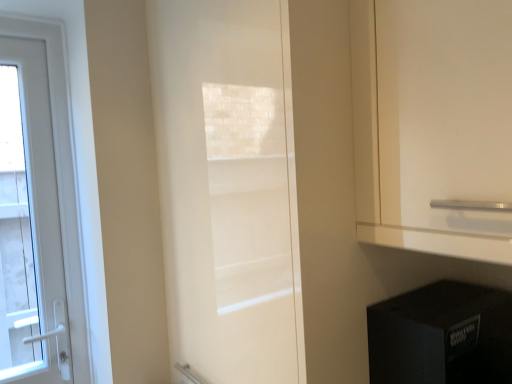
In order to face white glossy door at left, marked as the second door in a front-to-back arrangement, should I rotate leftwards or rightwards?

To face it directly, rotate left by 29.955 degrees.

Locate an element on the screen. white glossy door at left, arranged as the second door when viewed from the right is located at coordinates [x=30, y=224].

Considering the relative positions of black plastic speaker at lower right and white glossy door at left, arranged as the second door when viewed from the right, in the image provided, is black plastic speaker at lower right to the left of white glossy door at left, arranged as the second door when viewed from the right, from the viewer's perspective?

No, black plastic speaker at lower right is not to the left of white glossy door at left, arranged as the second door when viewed from the right.

From a real-world perspective, is black plastic speaker at lower right physically located above or below white glossy door at left, acting as the first door starting from the left?

black plastic speaker at lower right is situated lower than white glossy door at left, acting as the first door starting from the left, in the real world.

How different are the orientations of black plastic speaker at lower right and white glossy door at left, marked as the second door in a front-to-back arrangement, in degrees?

88.2 degrees.

Is black plastic speaker at lower right in front of or behind white glossy door at left, acting as the first door starting from the left, in the image?

Visually, black plastic speaker at lower right is located in front of white glossy door at left, acting as the first door starting from the left.

Which is in front, white glossy door at left, placed as the 1th door when sorted from back to front, or black plastic speaker at lower right?

black plastic speaker at lower right is in front.

The height and width of the screenshot is (384, 512). In order to click on appliance in front of the white glossy door at left, acting as the first door starting from the left in this screenshot , I will do click(x=442, y=336).

From the picture: In terms of size, does white glossy door at left, arranged as the second door when viewed from the right, appear bigger or smaller than black plastic speaker at lower right?

Clearly, white glossy door at left, arranged as the second door when viewed from the right, is smaller in size than black plastic speaker at lower right.

Looking at this image, is white glossy door at center, the 2th door when ordered from back to front, positioned before white glossy door at left, marked as the second door in a front-to-back arrangement?

That is True.

Where is `door located on the right of white glossy door at left, arranged as the second door when viewed from the right`? Image resolution: width=512 pixels, height=384 pixels. door located on the right of white glossy door at left, arranged as the second door when viewed from the right is located at coordinates (227, 189).

Between white glossy door at center, positioned as the 2th door in left-to-right order, and white glossy door at left, acting as the first door starting from the left, which one has larger size?

With larger size is white glossy door at center, positioned as the 2th door in left-to-right order.

Which of these two, white glossy door at center, which is the 1th door in front-to-back order, or white glossy door at left, placed as the 1th door when sorted from back to front, is thinner?

white glossy door at left, placed as the 1th door when sorted from back to front, is thinner.

Is white glossy door at center, which is the 1th door in front-to-back order, to the left or to the right of black plastic speaker at lower right in the image?

Clearly, white glossy door at center, which is the 1th door in front-to-back order, is on the left of black plastic speaker at lower right in the image.

From a real-world perspective, is white glossy door at center, which is the 1th door in front-to-back order, above or below black plastic speaker at lower right?

white glossy door at center, which is the 1th door in front-to-back order, is situated higher than black plastic speaker at lower right in the real world.

Is point (272, 122) in front of point (396, 301)?

Yes.

Which of these two, white glossy door at left, marked as the second door in a front-to-back arrangement, or white glossy door at center, which is the 1th door in front-to-back order, stands shorter?

white glossy door at left, marked as the second door in a front-to-back arrangement.

Locate an element on the screen. The image size is (512, 384). door above the white glossy door at left, marked as the second door in a front-to-back arrangement (from the image's perspective) is located at coordinates (227, 189).

Which object is more forward, white glossy door at left, placed as the 1th door when sorted from back to front, or white glossy door at center, which is the 1th door in front-to-back order?

white glossy door at center, which is the 1th door in front-to-back order.

Where is `appliance below the white glossy door at center, positioned as the 2th door in left-to-right order (from the image's perspective)`? appliance below the white glossy door at center, positioned as the 2th door in left-to-right order (from the image's perspective) is located at coordinates (442, 336).

Measure the distance from black plastic speaker at lower right to white glossy door at center, which is the 1th door in front-to-back order.

black plastic speaker at lower right and white glossy door at center, which is the 1th door in front-to-back order, are 43.42 centimeters apart from each other.

Is black plastic speaker at lower right oriented away from white glossy door at center, marked as the 1th door in a right-to-left arrangement?

black plastic speaker at lower right is not turned away from white glossy door at center, marked as the 1th door in a right-to-left arrangement.

From the image's perspective, is black plastic speaker at lower right under white glossy door at center, marked as the 1th door in a right-to-left arrangement?

Yes.

What are the coordinates of `appliance that is on the right side of white glossy door at left, placed as the 1th door when sorted from back to front` in the screenshot? It's located at (442, 336).

Locate an element on the screen. This screenshot has width=512, height=384. the 1st door located above the black plastic speaker at lower right (from a real-world perspective) is located at coordinates (30, 224).

Based on their spatial positions, is white glossy door at center, marked as the 1th door in a right-to-left arrangement, or white glossy door at left, acting as the first door starting from the left, further from black plastic speaker at lower right?

white glossy door at left, acting as the first door starting from the left, lies further to black plastic speaker at lower right than the other object.

Estimate the real-world distances between objects in this image. Which object is closer to white glossy door at left, arranged as the second door when viewed from the right, black plastic speaker at lower right or white glossy door at center, marked as the 1th door in a right-to-left arrangement?

white glossy door at center, marked as the 1th door in a right-to-left arrangement, lies closer to white glossy door at left, arranged as the second door when viewed from the right, than the other object.

Based on their spatial positions, is black plastic speaker at lower right or white glossy door at left, placed as the 1th door when sorted from back to front, further from white glossy door at center, positioned as the 2th door in left-to-right order?

The object further to white glossy door at center, positioned as the 2th door in left-to-right order, is white glossy door at left, placed as the 1th door when sorted from back to front.

When comparing their distances from white glossy door at left, marked as the second door in a front-to-back arrangement, does white glossy door at center, marked as the 1th door in a right-to-left arrangement, or black plastic speaker at lower right seem closer?

The object closer to white glossy door at left, marked as the second door in a front-to-back arrangement, is white glossy door at center, marked as the 1th door in a right-to-left arrangement.

From the picture: Estimate the real-world distances between objects in this image. Which object is closer to black plastic speaker at lower right, white glossy door at left, marked as the second door in a front-to-back arrangement, or white glossy door at center, which is the 1th door in front-to-back order?

The object closer to black plastic speaker at lower right is white glossy door at center, which is the 1th door in front-to-back order.

Which object lies further to the anchor point white glossy door at center, the 2th door when ordered from back to front, white glossy door at left, placed as the 1th door when sorted from back to front, or black plastic speaker at lower right?

white glossy door at left, placed as the 1th door when sorted from back to front, is further to white glossy door at center, the 2th door when ordered from back to front.

Find the location of a particular element. The image size is (512, 384). door situated between white glossy door at left, marked as the second door in a front-to-back arrangement, and black plastic speaker at lower right from left to right is located at coordinates coord(227,189).